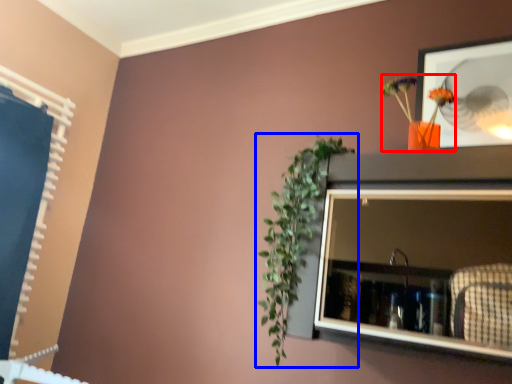
Question: Which object is closer to the camera taking this photo, floral arrangement (highlighted by a red box) or houseplant (highlighted by a blue box)?

Choices:
 (A) floral arrangement
 (B) houseplant

Answer: (B)